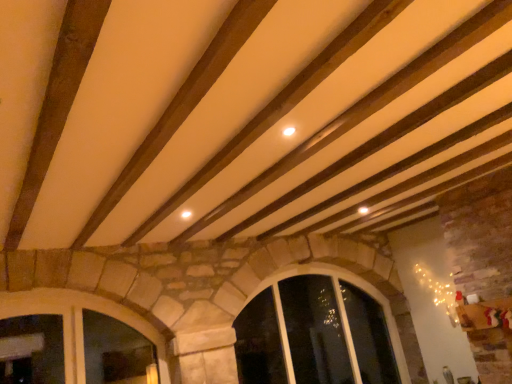
Question: From a real-world perspective, relative to clear glass window at center, which ranks as the first window in right-to-left order, is stone textured window at lower left, positioned as the 2th window in right-to-left order, vertically above or below?

Choices:
 (A) below
 (B) above

Answer: (B)

Question: Is stone textured window at lower left, which appears as the 2th window when viewed from the back, wider or thinner than clear glass window at center, which is counted as the first window, starting from the back?

Choices:
 (A) thin
 (B) wide

Answer: (A)

Question: Based on their sizes in the image, would you say stone textured window at lower left, positioned as the 2th window in right-to-left order, is bigger or smaller than clear glass window at center, which is counted as the first window, starting from the back?

Choices:
 (A) small
 (B) big

Answer: (A)

Question: Which is correct: clear glass window at center, placed as the second window when sorted from left to right, is inside stone textured window at lower left, which appears as the 2th window when viewed from the back, or outside of it?

Choices:
 (A) outside
 (B) inside

Answer: (A)

Question: Considering the positions of clear glass window at center, acting as the second window starting from the front, and stone textured window at lower left, positioned as the 2th window in right-to-left order, in the image, is clear glass window at center, acting as the second window starting from the front, taller or shorter than stone textured window at lower left, positioned as the 2th window in right-to-left order,?

Choices:
 (A) tall
 (B) short

Answer: (A)

Question: Is clear glass window at center, placed as the second window when sorted from left to right, wider or thinner than stone textured window at lower left, the first window in the left-to-right sequence?

Choices:
 (A) wide
 (B) thin

Answer: (A)

Question: Is clear glass window at center, placed as the second window when sorted from left to right, bigger or smaller than stone textured window at lower left, the first window in the left-to-right sequence?

Choices:
 (A) big
 (B) small

Answer: (A)